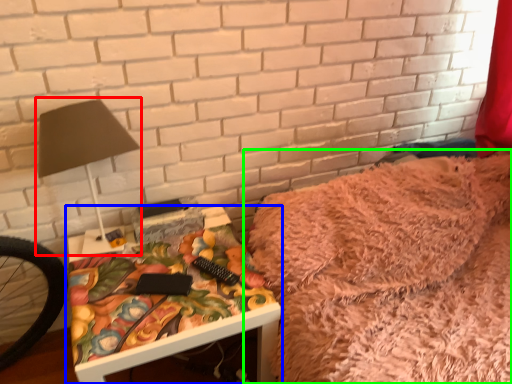
Question: Estimate the real-world distances between objects in this image. Which object is farther from table lamp (highlighted by a red box), table (highlighted by a blue box) or furniture (highlighted by a green box)?

Choices:
 (A) table
 (B) furniture

Answer: (B)